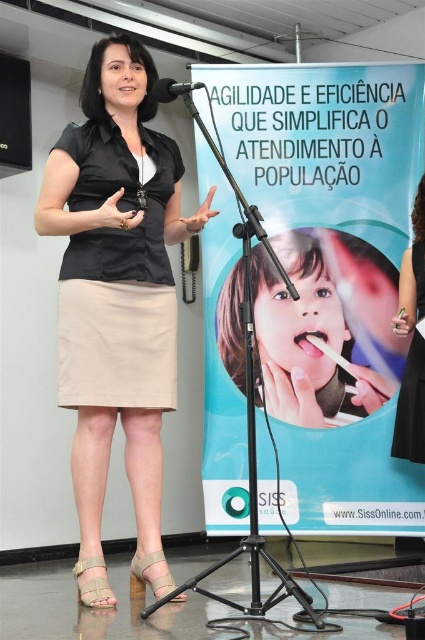
Can you confirm if beige fabric skirt at center is shorter than black satin dress at right?

In fact, beige fabric skirt at center may be taller than black satin dress at right.

Is beige fabric skirt at center wider than black satin dress at right?

Correct, the width of beige fabric skirt at center exceeds that of black satin dress at right.

Between point (164, 307) and point (424, 451), which one is positioned in front?

Positioned in front is point (164, 307).

Image resolution: width=425 pixels, height=640 pixels. I want to click on beige fabric skirt at center, so click(x=118, y=276).

Consider the image. Which is more to the right, beige fabric skirt at center or black leather skirt at lower left?

beige fabric skirt at center is more to the right.

Is beige fabric skirt at center above black leather skirt at lower left?

Actually, beige fabric skirt at center is below black leather skirt at lower left.

Is point (64, 380) positioned after point (20, 134)?

No, (64, 380) is in front of (20, 134).

You are a GUI agent. You are given a task and a screenshot of the screen. Output one action in this format:
    pyautogui.click(x=<x>, y=<y>)
    Task: Click on the beige fabric skirt at center
    
    Given the screenshot: What is the action you would take?
    [118, 276]

Is blue glossy poster at center shorter than beige fabric skirt at center?

No.

Is point (350, 269) farther from viewer compared to point (136, 332)?

Yes, it is behind point (136, 332).

At what (x,y) coordinates should I click in order to perform the action: click on blue glossy poster at center. Please return your answer as a coordinate pair (x, y). Image resolution: width=425 pixels, height=640 pixels. Looking at the image, I should click on (328, 273).